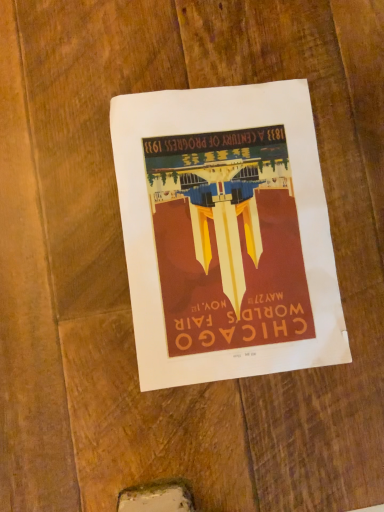
Locate an element on the screen. free spot above matte paper poster at center (from a real-world perspective) is located at coordinates pos(230,236).